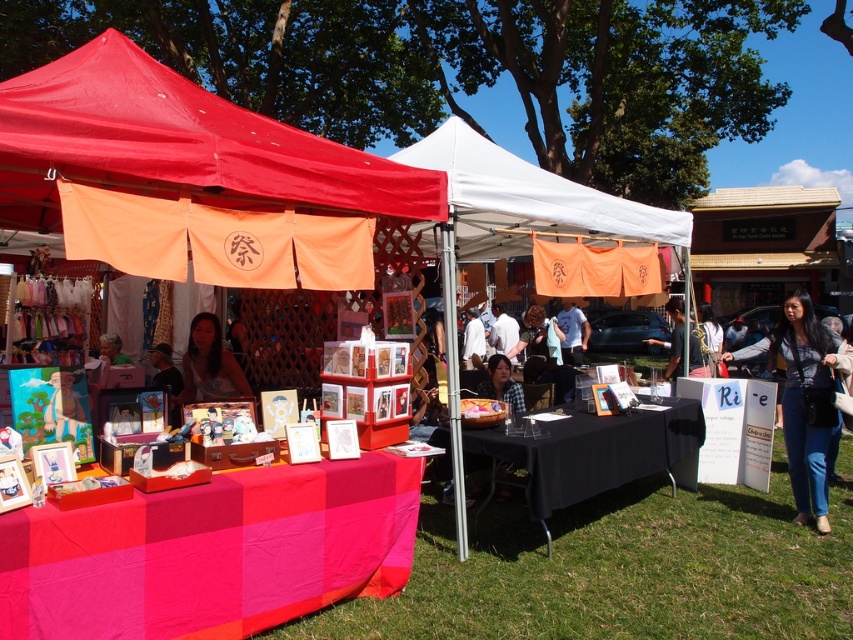
Does matte red tablecloth at lower left appear over matte white shirt at center?

No.

Between matte red tablecloth at lower left and matte white shirt at center, which one has less height?

matte red tablecloth at lower left

Is point (160, 524) less distant than point (575, 316)?

Yes, point (160, 524) is in front of point (575, 316).

You are a GUI agent. You are given a task and a screenshot of the screen. Output one action in this format:
    pyautogui.click(x=<x>, y=<y>)
    Task: Click on the matte red tablecloth at lower left
    The height and width of the screenshot is (640, 853).
    Given the screenshot: What is the action you would take?
    pyautogui.click(x=212, y=552)

Who is positioned more to the right, red fabric canopy at upper left or black matte table at center?

From the viewer's perspective, black matte table at center appears more on the right side.

Does red fabric canopy at upper left come behind black matte table at center?

No, red fabric canopy at upper left is in front of black matte table at center.

This screenshot has height=640, width=853. In order to click on red fabric canopy at upper left in this screenshot , I will do `click(178, 145)`.

Identify the location of red fabric canopy at upper left. (178, 145).

Is point (48, 534) closer to viewer compared to point (183, 372)?

Yes, point (48, 534) is in front of point (183, 372).

Is matte red tablecloth at lower left taller than matte black hair at center?

Correct, matte red tablecloth at lower left is much taller as matte black hair at center.

Does point (389, 516) lie behind point (193, 360)?

No, it is in front of (193, 360).

Find the location of a particular element. This screenshot has width=853, height=640. matte red tablecloth at lower left is located at coordinates (212, 552).